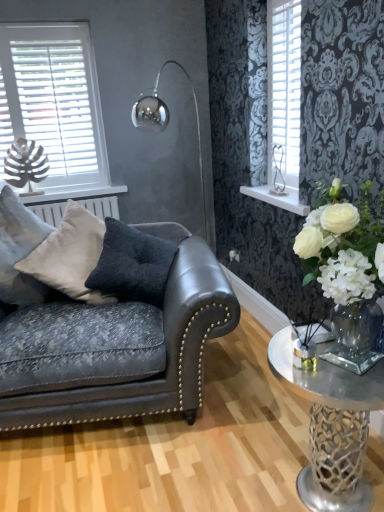
Image resolution: width=384 pixels, height=512 pixels. I want to click on vacant space situated on the left part of clear glass vase at right, so click(x=203, y=467).